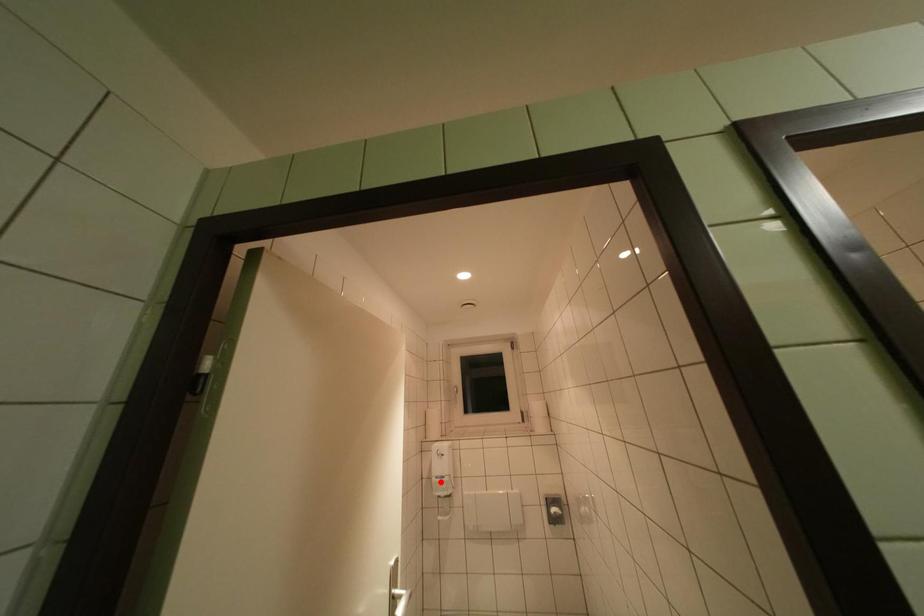
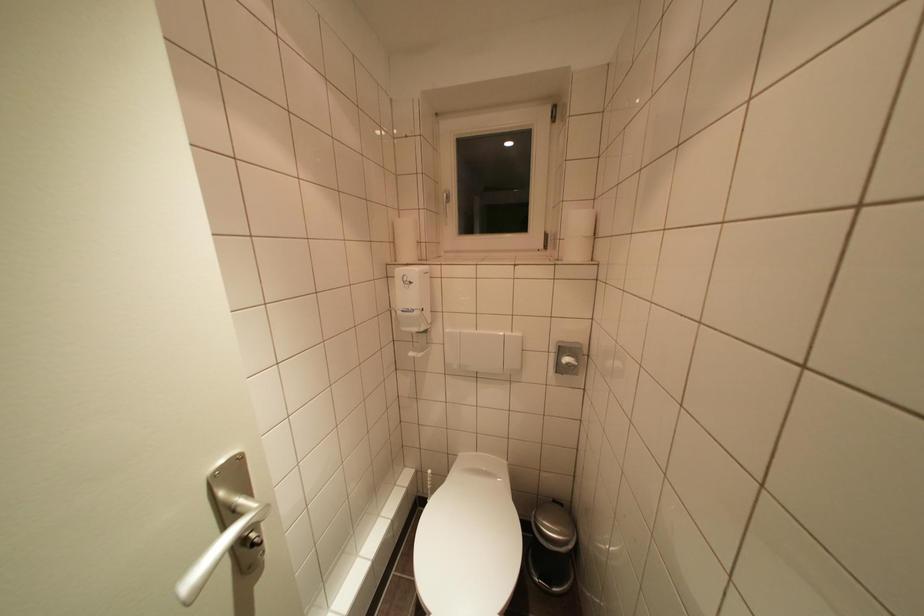
Question: I am providing you with two images of the same scene from different viewpoints. A red point is marked on the first image. Is the red point's position out of view in image 2?

Choices:
 (A) Yes
 (B) No

Answer: (B)